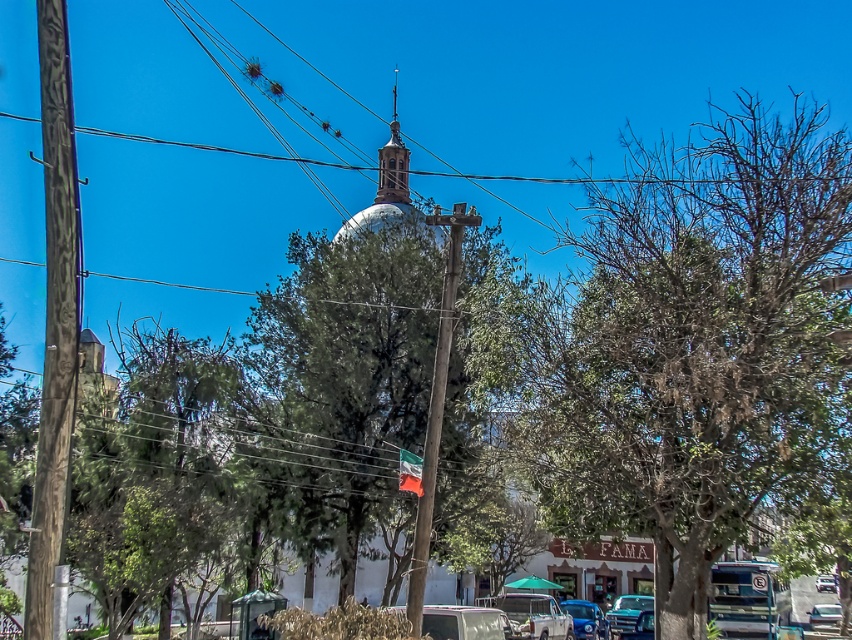
Looking at this image, you are a photographer standing on the sidewalk in front of the building. You want to take a photo of the matte white dome at center without the green leafy tree at upper right blocking it. Is this possible given their positions?

The green leafy tree at upper right is closer to the viewer than the matte white dome at center, so moving closer to the dome or adjusting your angle might allow you to frame the shot without the tree obstructing it.

You are a pedestrian standing at the edge of the street looking at the white matte van at lower center and the metallic silver car at lower right. Which vehicle is closer to you?

The white matte van at lower center is closer to you because it is positioned over the metallic silver car at lower right, indicating it is in front.

You are a pedestrian standing on the sidewalk and want to cross the street to reach the white building with the dome. There is a white matte van at lower center and a metallic silver car at lower right in your path. Which vehicle should you avoid first to safely navigate around them?

The white matte van at lower center is closer to the viewer than the metallic silver car at lower right, so you should avoid the white matte van at lower center first to safely navigate around them.